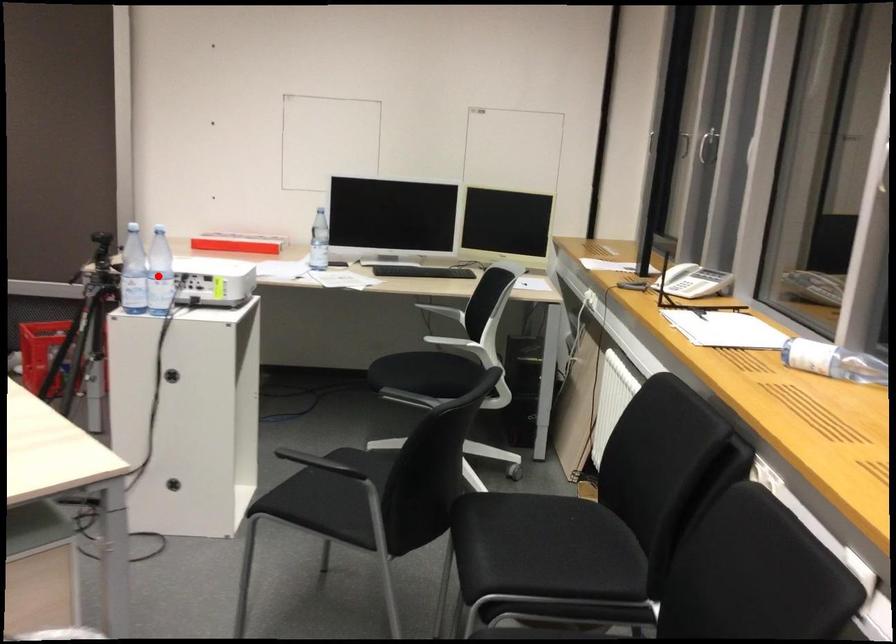
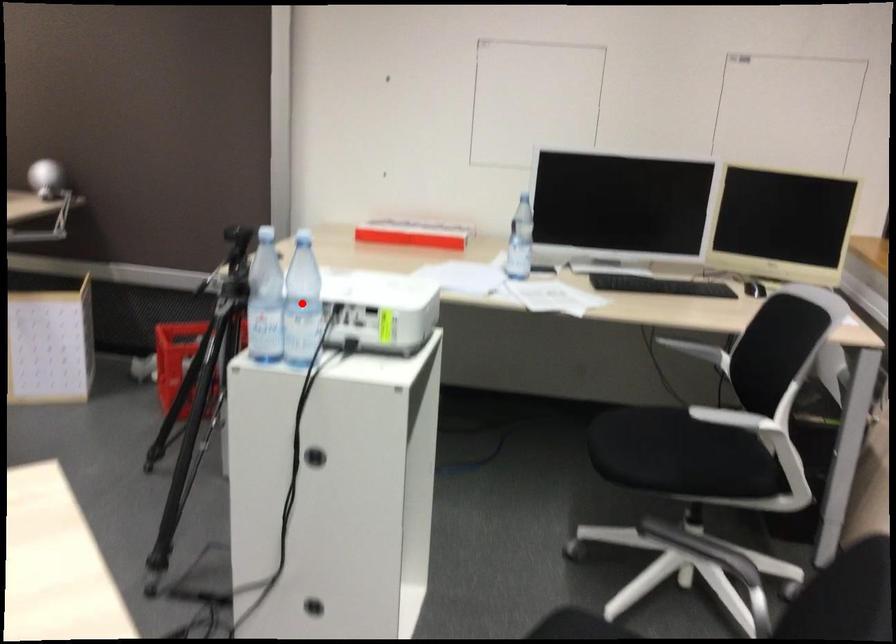
Consider the image. I am providing you with two images of the same scene from different viewpoints. A red point is marked on the first image and another point is marked on the second image. Are the points marked in image1 and image2 representing the same 3D position?

Yes